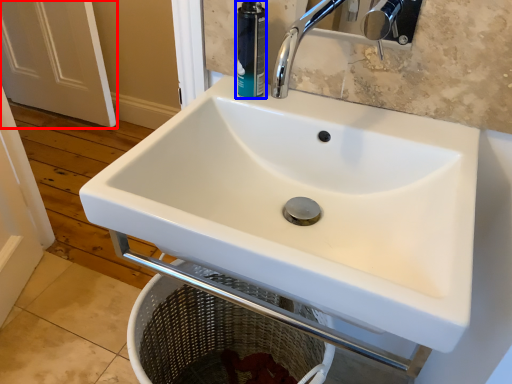
Question: Which object is further to the camera taking this photo, screen door (highlighted by a red box) or toiletry (highlighted by a blue box)?

Choices:
 (A) screen door
 (B) toiletry

Answer: (A)